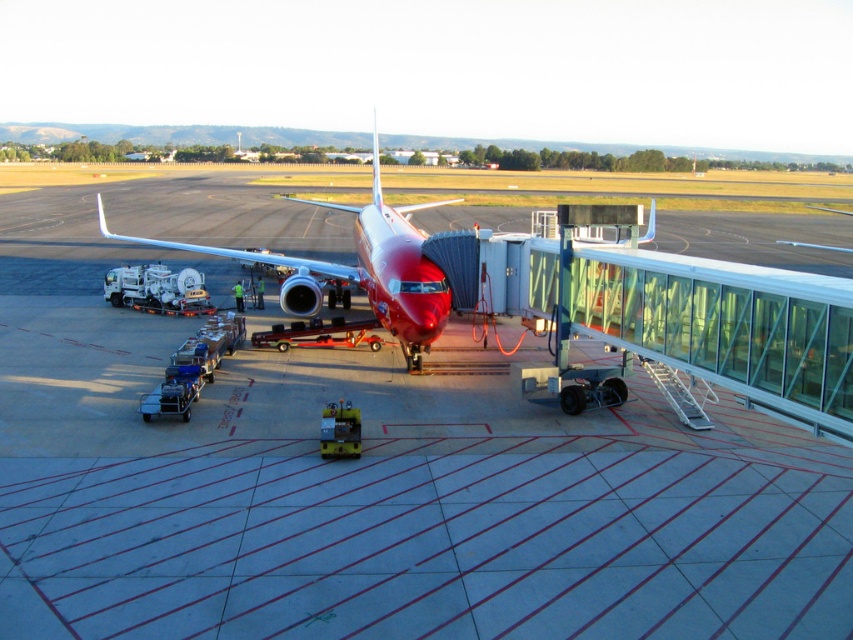
This screenshot has height=640, width=853. Describe the element at coordinates (366, 470) in the screenshot. I see `smooth concrete tarmac at center` at that location.

At what (x,y) coordinates should I click in order to perform the action: click on smooth concrete tarmac at center. Please return your answer as a coordinate pair (x, y). Looking at the image, I should click on [x=366, y=470].